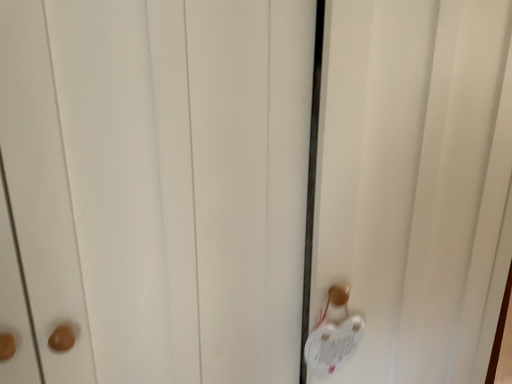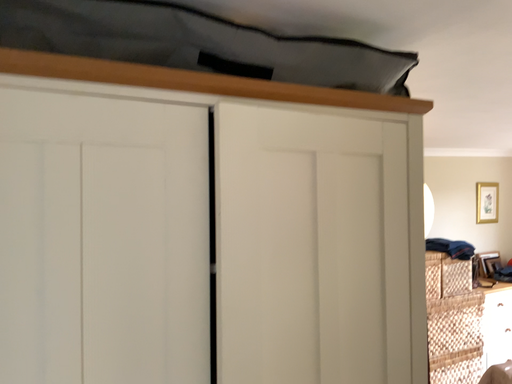
Question: How did the camera likely rotate when shooting the video?

Choices:
 (A) rotated left
 (B) rotated right

Answer: (B)